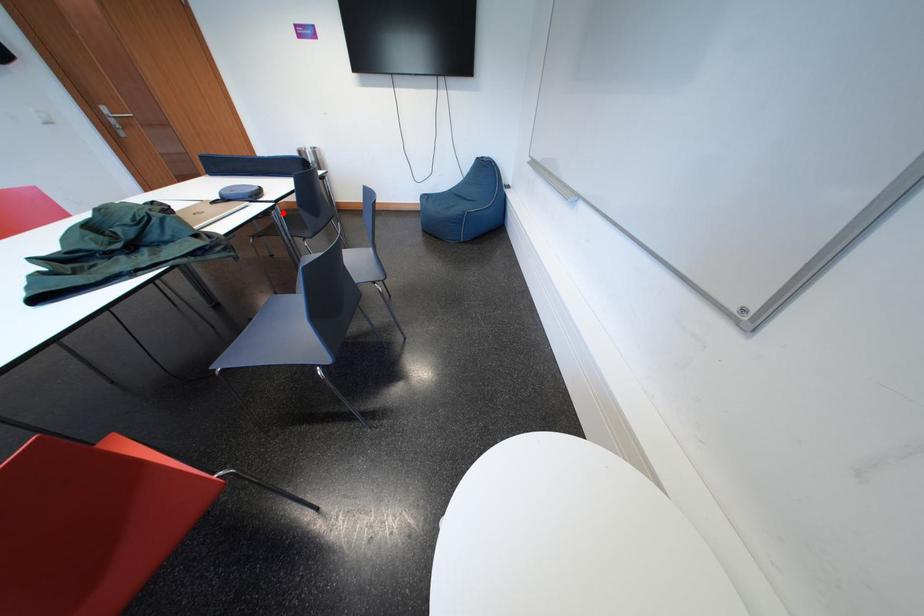
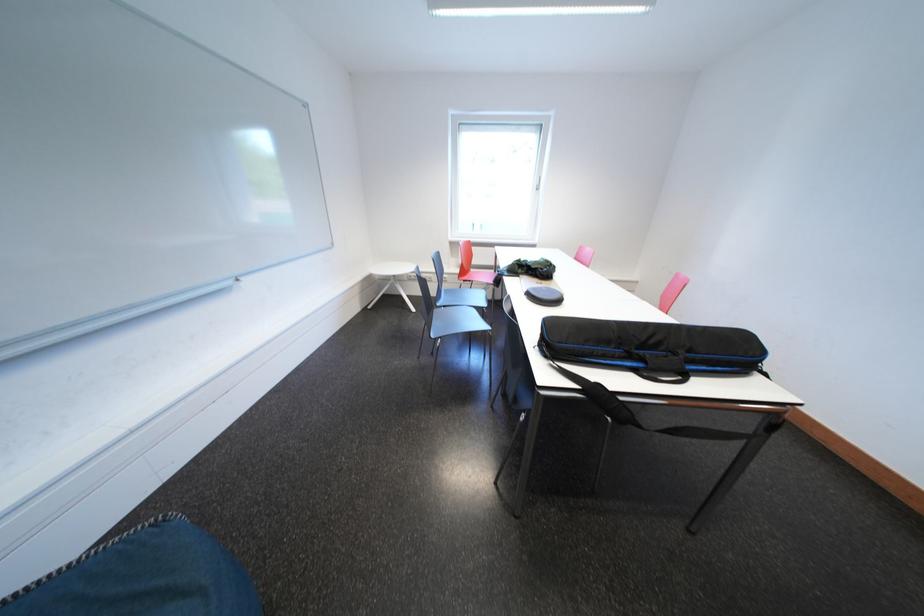
Question: I am providing you with two images of the same scene from different viewpoints. A red point is marked on the first image. Is the red point's position out of view in image 2?

Choices:
 (A) Yes
 (B) No

Answer: (A)